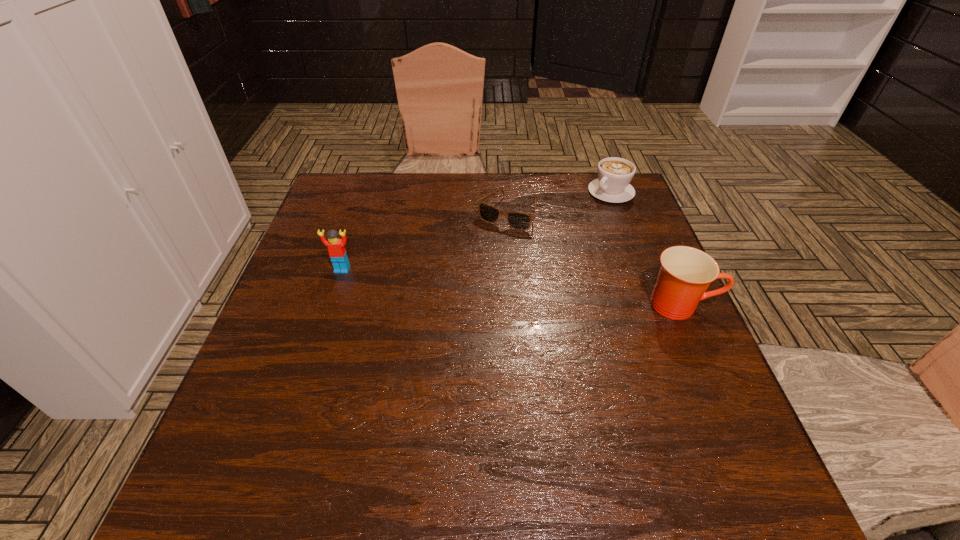
Identify the location of free space on the desktop that is between the second nearest object and the cup and is positioned on the frames of the third object from right to left. The width and height of the screenshot is (960, 540). (462, 282).

Locate an element on the screen. The width and height of the screenshot is (960, 540). free space on the desktop that is between the leftmost object and the nearest object and is positioned to the right of the cappuccino's handle is located at coordinates (498, 286).